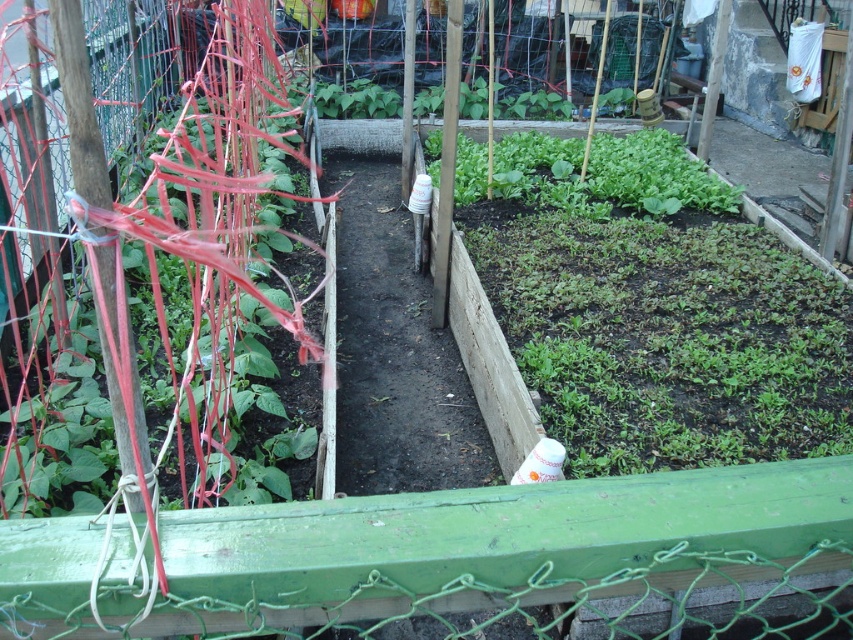
You are a gardener who wants to plant a new flower in the garden. You have two options, the green matte plant at left and the green leafy at center. Which one requires more space to grow?

The green matte plant at left requires more space to grow because it has a larger size compared to the green leafy at center.

Consider the image. You are a gardener who needs to water the green matte plant at left. Your watering can has a maximum reach of 60 centimeters. Can you water the plant without moving closer?

The green matte plant at left and the viewer are 62.39 centimeters apart, which is beyond the watering can reach of 60 centimeters. Therefore, you need to move closer to water the plant.

You are standing in the garden and see the point marked at coordinates (x=157, y=308). What object is this point located on?

The point is on the green matte plant at left.